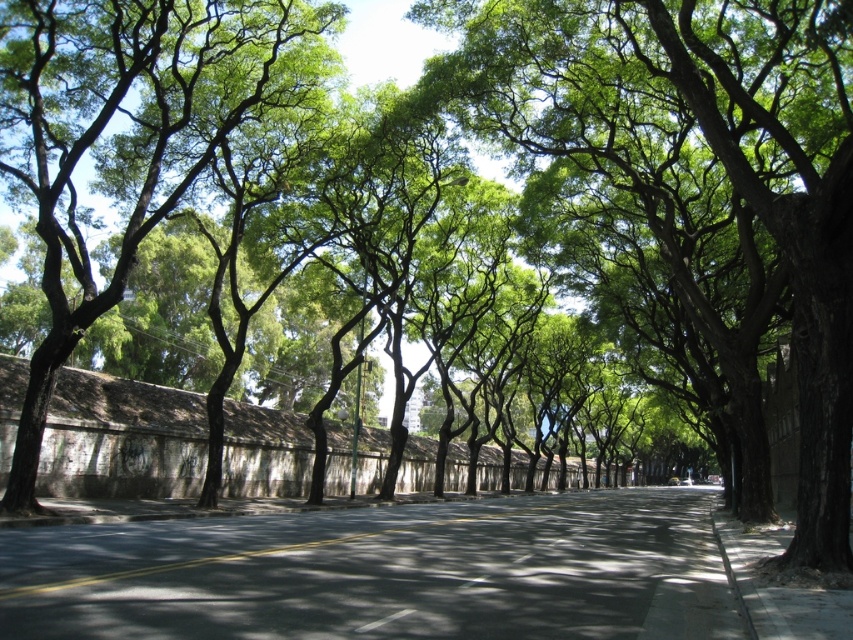
You are a city planner assessing the road safety of this urban street. You notice the dark gray asphalt at center and the white glossy line at center. Which of these two features occupies a larger area on the road surface?

The dark gray asphalt at center is bigger than the white glossy line at center, so the dark gray asphalt at center occupies a larger area on the road surface.

You are standing on the sidewalk in the urban street scene. You notice two points marked on the road surface. Which point is closer to your current position? The points are labeled as point (660, 611) and point (381, 625).

Point (660, 611) is further to the viewer than point (381, 625), so the closer point to your current position is point (381, 625).

You are a street painter who needs to paint over the dark gray asphalt at center and the white glossy line at center. Which object is taller so that you need to adjust your ladder height accordingly?

The dark gray asphalt at center is much taller than the white glossy line at center, so you need to adjust your ladder to reach its height.